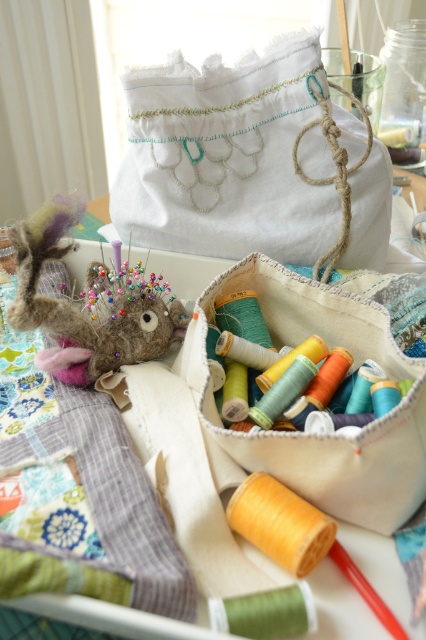
You are organizing a craft fair booth and need to arrange items on a display table. You have the white fabric pouch at upper center and the fuzzy brown stuffed animal at left. According to the scene, which item is positioned closer to the front of the table?

The white fabric pouch at upper center is closer to the front of the table because the fuzzy brown stuffed animal at left is behind it.

You are a tailor working in this workspace and need to reach the white fabric pouch at upper center. If your arm can extend 50 centimeters, can you comfortably reach it without moving your chair?

The distance between you and the white fabric pouch at upper center is 49.68 centimeters, which is just under the 50 centimeter reach of your arm. Therefore, you can comfortably reach it without moving your chair.